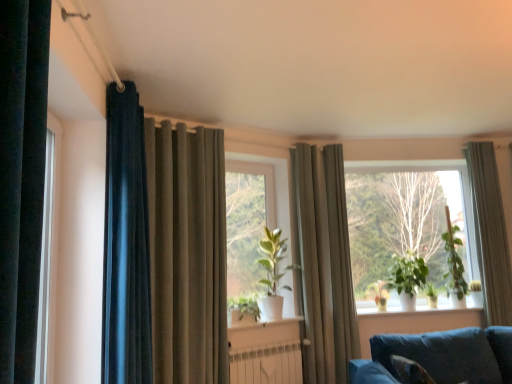
Question: Is velvet blue couch at lower right taller than green matte plant at center, the first plant when ordered from left to right?

Choices:
 (A) yes
 (B) no

Answer: (A)

Question: Would you consider velvet blue couch at lower right to be distant from green matte plant at center, the fifth plant positioned from the right?

Choices:
 (A) no
 (B) yes

Answer: (B)

Question: Is velvet blue couch at lower right next to green matte plant at center, the fifth plant positioned from the right, and touching it?

Choices:
 (A) yes
 (B) no

Answer: (B)

Question: Is green matte plant at center, the fifth plant positioned from the right, located within velvet blue couch at lower right?

Choices:
 (A) no
 (B) yes

Answer: (A)

Question: From a real-world perspective, is velvet blue couch at lower right on green matte plant at center, the first plant when ordered from left to right?

Choices:
 (A) yes
 (B) no

Answer: (B)

Question: Does velvet blue couch at lower right lie behind green matte plant at center, the first plant when ordered from left to right?

Choices:
 (A) yes
 (B) no

Answer: (B)

Question: Does green matte plant at center, the fifth plant positioned from the right, have a smaller size compared to green matte plant at center, the 1th window from the back?

Choices:
 (A) no
 (B) yes

Answer: (B)

Question: Is green matte plant at center, the first plant when ordered from left to right, next to green matte plant at center, marked as the 2th window in a left-to-right arrangement?

Choices:
 (A) yes
 (B) no

Answer: (B)

Question: Is green matte plant at center, the fifth plant positioned from the right, bigger than green matte plant at center, the 1th window from the back?

Choices:
 (A) yes
 (B) no

Answer: (B)

Question: Would you say green matte plant at center, the fifth plant positioned from the right, is outside green matte plant at center, the 1th window from the back?

Choices:
 (A) yes
 (B) no

Answer: (A)

Question: Is green matte plant at center, the fifth plant positioned from the right, taller than green matte plant at center, the 1th window from the back?

Choices:
 (A) no
 (B) yes

Answer: (A)

Question: Is green matte plant at center, the first plant when ordered from left to right, to the left of green matte plant at center, which is counted as the first window, starting from the right, from the viewer's perspective?

Choices:
 (A) no
 (B) yes

Answer: (B)

Question: Can you confirm if green matte plant at right, the second plant viewed from the right, is positioned to the left of green matte plant at center?

Choices:
 (A) no
 (B) yes

Answer: (A)